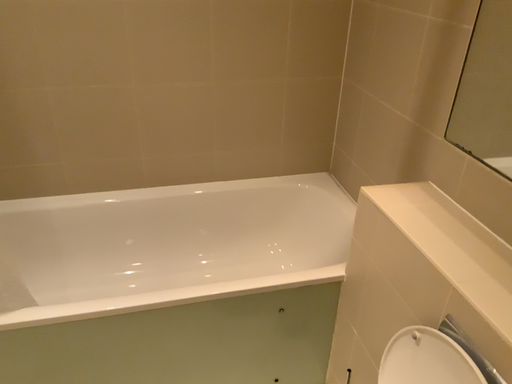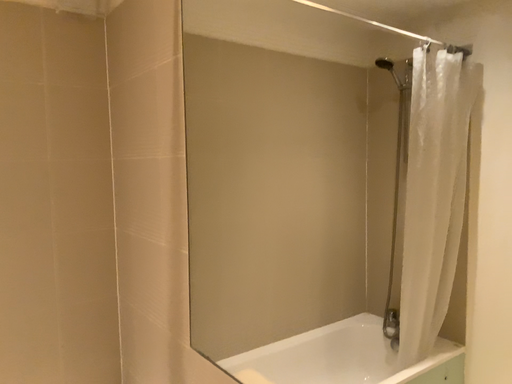
Question: How did the camera likely rotate when shooting the video?

Choices:
 (A) rotated upward
 (B) rotated downward

Answer: (A)